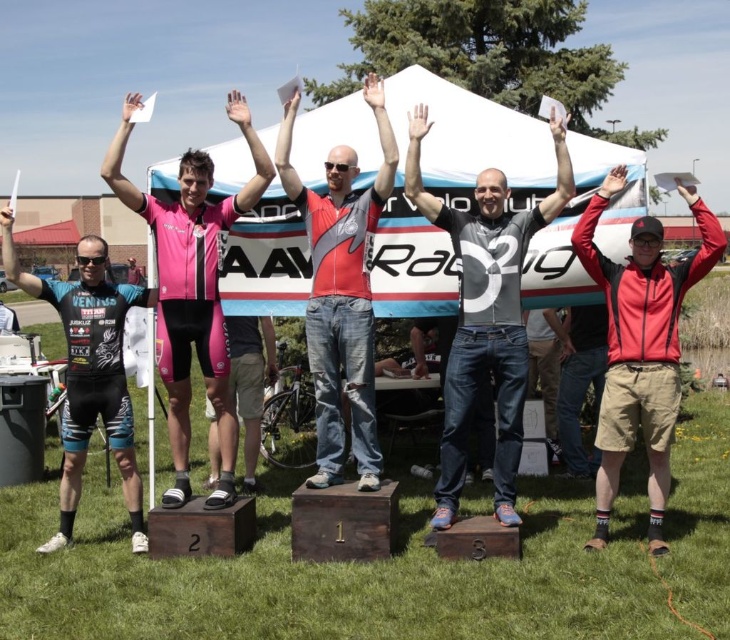
Question: Among these objects, which one is farthest from the camera?

Choices:
 (A) red matte jacket at center
 (B) red matte jersey at center
 (C) matte black cycling suit at center
 (D) pink matte cycling suit at center

Answer: (B)

Question: Does blue jeans at center lie in front of pink matte cycling suit at center?

Choices:
 (A) yes
 (B) no

Answer: (B)

Question: Which object is farther from the camera taking this photo?

Choices:
 (A) red matte jacket at center
 (B) matte black cycling suit at center

Answer: (B)

Question: Estimate the real-world distances between objects in this image. Which object is closer to the matte black cycling suit at center?

Choices:
 (A) red matte jacket at center
 (B) red matte jersey at center
 (C) blue jeans at center
 (D) pink matte cycling suit at center

Answer: (D)

Question: Is red matte jacket at center bigger than red matte jersey at center?

Choices:
 (A) yes
 (B) no

Answer: (B)

Question: Does blue jeans at center have a larger size compared to matte black cycling suit at center?

Choices:
 (A) no
 (B) yes

Answer: (B)